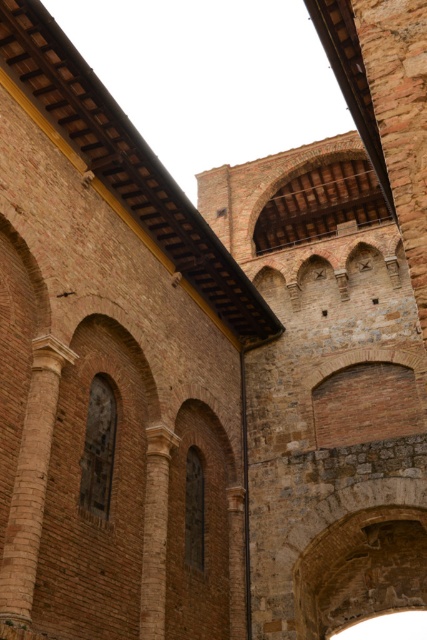
From the picture: You are an architect inspecting the historic building. You notice the smooth tan stone column at left and the brown rough stone pillar at center. Which one has a larger size?

The smooth tan stone column at left is bigger than the brown rough stone pillar at center, so the smooth tan stone column at left has a larger size.

You are an architect analyzing the facade of this historic building. You notice two structural elements. Which one is positioned to the left of the other? The smooth tan stone column at left and the brown rough stone pillar at center are both visible. Can you determine their spatial arrangement?

The smooth tan stone column at left is positioned to the left of the brown rough stone pillar at center.

You are standing in front of the historic building and want to locate the brown rough stone pillar at center. According to the coordinates provided, where should you look relative to the center of the image?

The brown rough stone pillar at center is located at coordinates point (x=155, y=531), which means it is positioned to the right and slightly below the center of the image.